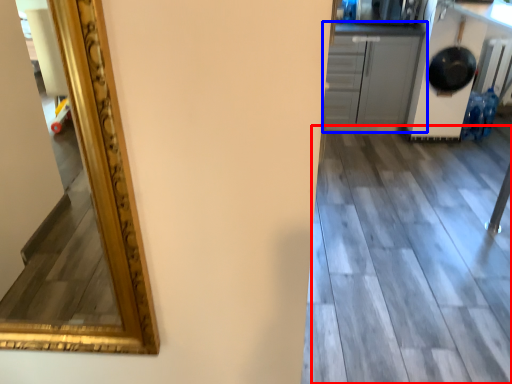
Question: Which object appears closest to the camera in this image, tile (highlighted by a red box) or cabinetry (highlighted by a blue box)?

Choices:
 (A) tile
 (B) cabinetry

Answer: (A)